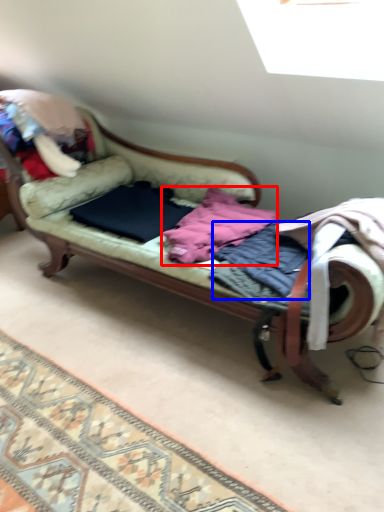
Question: Which of the following is the closest to the observer, clothing (highlighted by a red box) or clothing (highlighted by a blue box)?

Choices:
 (A) clothing
 (B) clothing

Answer: (B)